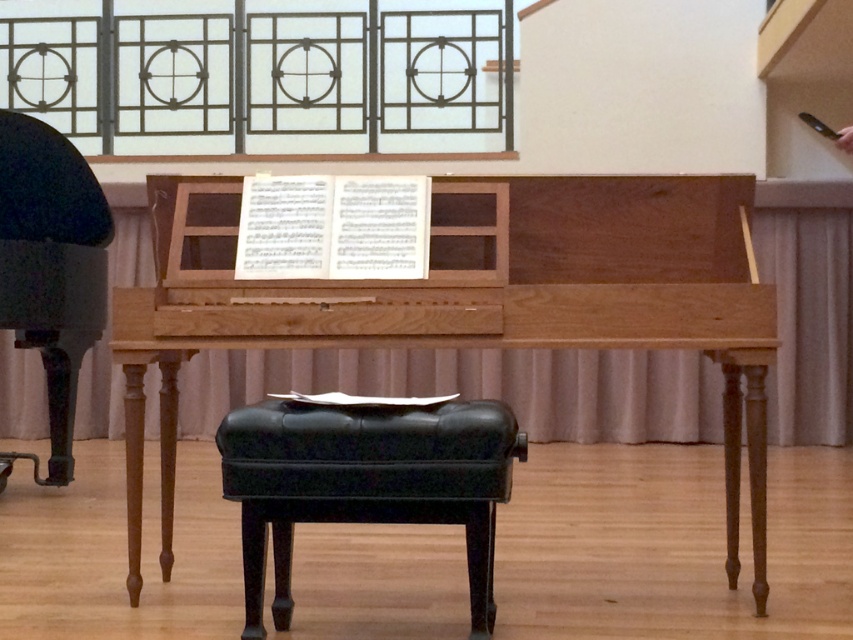
In the scene shown: Who is positioned more to the right, natural wood piano at center or black leather stool at center?

Positioned to the right is natural wood piano at center.

Is natural wood piano at center taller than black leather stool at center?

Yes, natural wood piano at center is taller than black leather stool at center.

The width and height of the screenshot is (853, 640). Describe the element at coordinates (473, 300) in the screenshot. I see `natural wood piano at center` at that location.

The image size is (853, 640). I want to click on natural wood piano at center, so click(x=473, y=300).